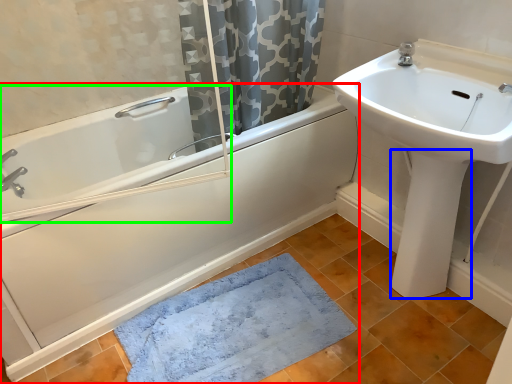
Question: Considering the real-world distances, which object is farthest from bathtub (highlighted by a red box)? bidet (highlighted by a blue box) or bath (highlighted by a green box)?

Choices:
 (A) bidet
 (B) bath

Answer: (A)